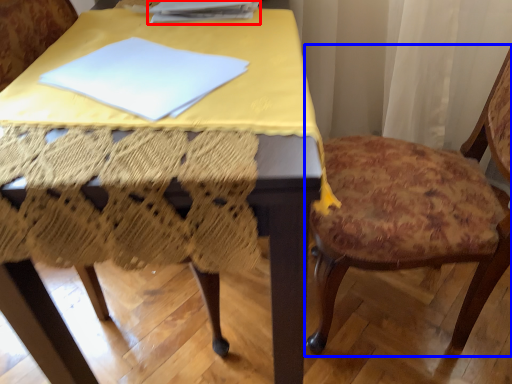
Question: Which of the following is the closest to the observer, paperback book (highlighted by a red box) or chair (highlighted by a blue box)?

Choices:
 (A) paperback book
 (B) chair

Answer: (B)